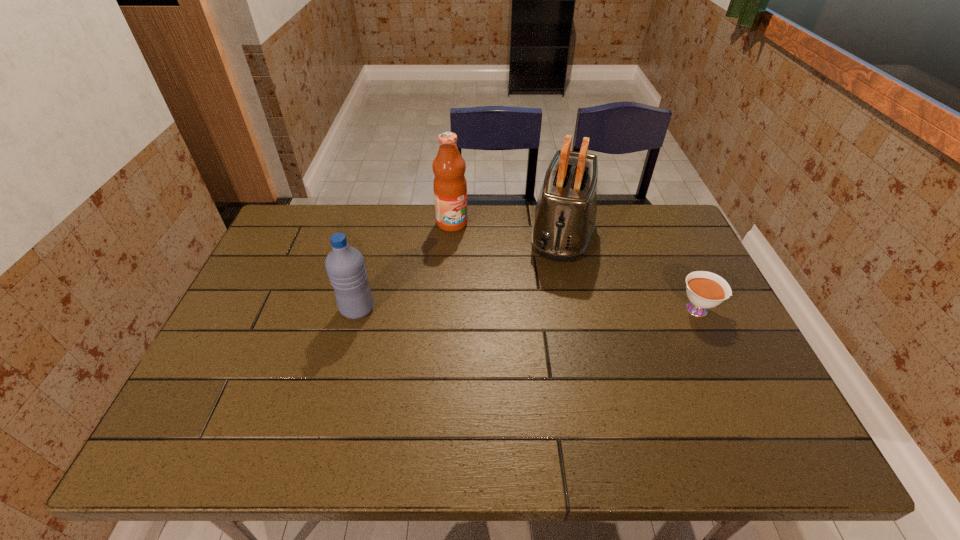
Identify the location of vacant space situated on the side of the third object from left to right with the control lever. (545, 325).

Locate an element on the screen. The image size is (960, 540). vacant region located on the side of the third object from left to right with the control lever is located at coordinates (540, 351).

You are a GUI agent. You are given a task and a screenshot of the screen. Output one action in this format:
    pyautogui.click(x=<x>, y=<y>)
    Task: Click on the vacant point located 0.110m on the side of the third object from left to right with the control lever
    The image size is (960, 540).
    Given the screenshot: What is the action you would take?
    pyautogui.click(x=553, y=294)

Identify the location of fruit juice present at the far edge. Image resolution: width=960 pixels, height=540 pixels. (450, 187).

This screenshot has width=960, height=540. What are the coordinates of `toaster that is at the far edge` in the screenshot? It's located at tap(564, 220).

The image size is (960, 540). In order to click on object that is at the right edge in this screenshot , I will do `click(704, 290)`.

Locate an element on the screen. Image resolution: width=960 pixels, height=540 pixels. vacant space at the far edge is located at coordinates (421, 239).

The image size is (960, 540). In the image, there is a desktop. In order to click on vacant space at the near edge in this screenshot , I will do `click(607, 413)`.

In the image, there is a desktop. Identify the location of vacant space at the left edge. (276, 298).

At what (x,y) coordinates should I click in order to perform the action: click on free space at the right edge of the desktop. Please return your answer as a coordinate pair (x, y). The width and height of the screenshot is (960, 540). Looking at the image, I should click on (703, 369).